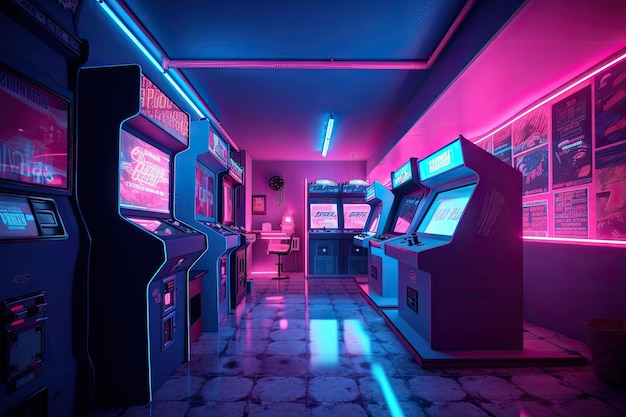
At what (x,y) coordinates should I click in order to perform the action: click on shiny smooth floor. Please return your answer as a coordinate pair (x, y). The height and width of the screenshot is (417, 626). Looking at the image, I should click on (329, 366).